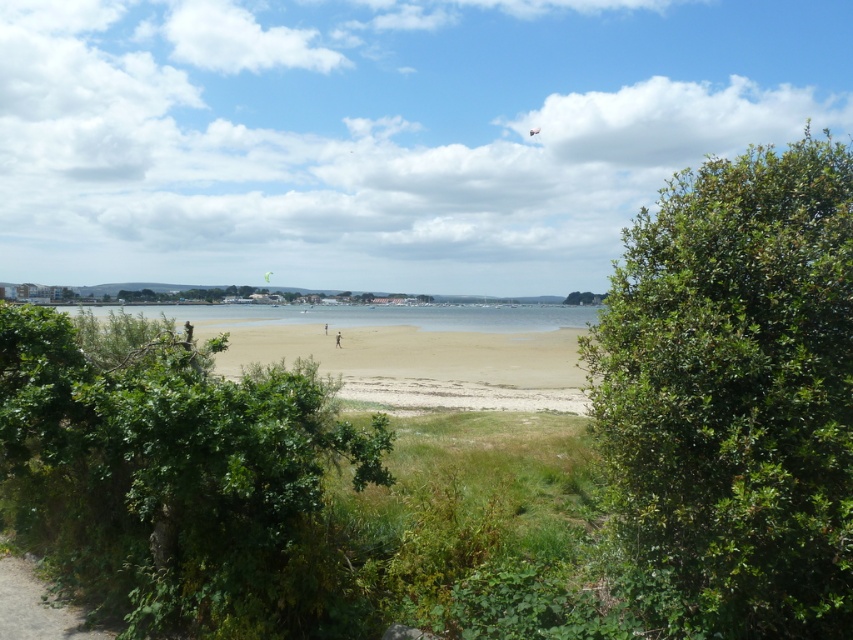
You are standing at the point marked by point (412, 352) in the coastal scene. What type of surface are you currently standing on?

You are standing on brown sand at center.

You are standing at the edge of the beach looking towards the water. There are two points marked in the image. The first point is at coordinate point (846, 186) and the second is at point (456, 332). Which point is closer to you?

Point (846, 186) is in front of point (456, 332), so it is closer to you.